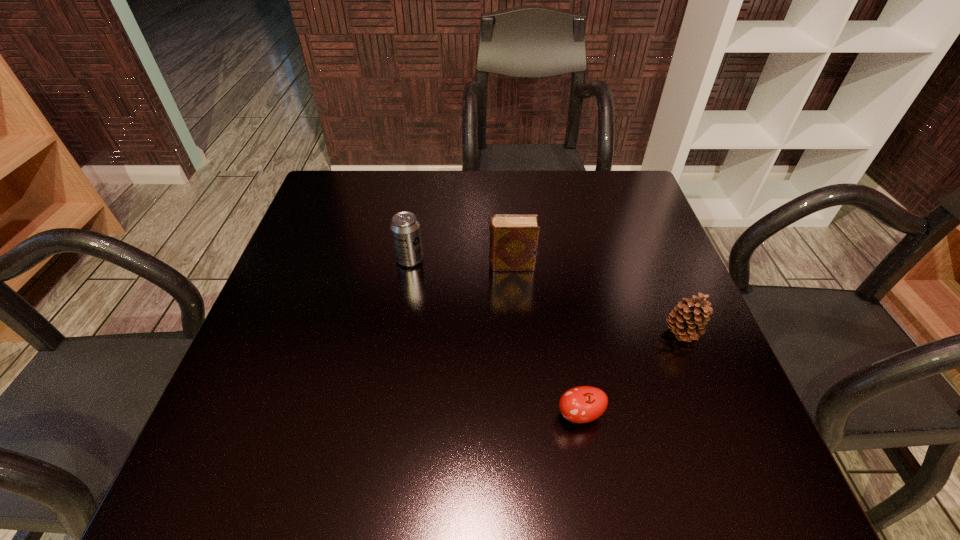
In order to click on the third object from right to left in this screenshot , I will do `click(514, 238)`.

Identify the location of beer can. (405, 229).

Locate an element on the screen. This screenshot has height=540, width=960. the second nearest object is located at coordinates (688, 318).

Locate an element on the screen. The image size is (960, 540). the rightmost object is located at coordinates (688, 318).

I want to click on apple, so [x=582, y=404].

Image resolution: width=960 pixels, height=540 pixels. Identify the location of the third object from left to right. (582, 404).

Where is `vacant point located on the spine side of the diary`? The image size is (960, 540). vacant point located on the spine side of the diary is located at coordinates (329, 265).

This screenshot has height=540, width=960. Identify the location of free space located on the spine side of the diary. (416, 265).

This screenshot has width=960, height=540. In order to click on free space located 0.250m on the spine side of the diary in this screenshot , I will do `click(381, 265)`.

This screenshot has width=960, height=540. Identify the location of blank space located on the front of the leftmost object. pyautogui.click(x=386, y=408).